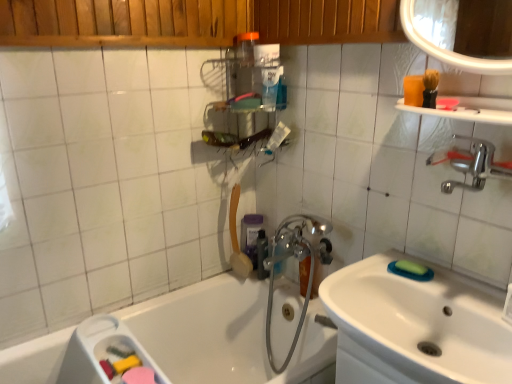
Where is `free space behind green sponge at sink`? The height and width of the screenshot is (384, 512). free space behind green sponge at sink is located at coordinates (399, 258).